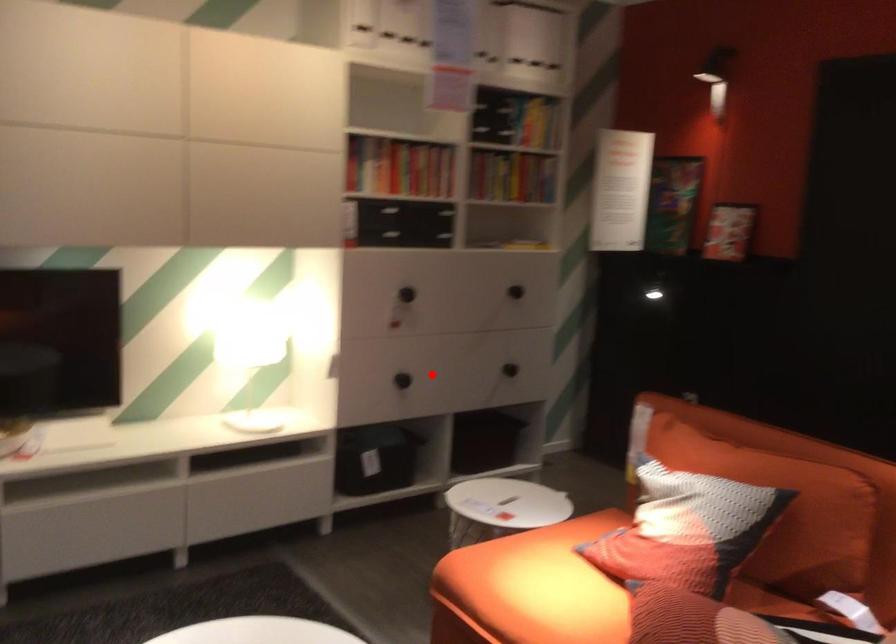
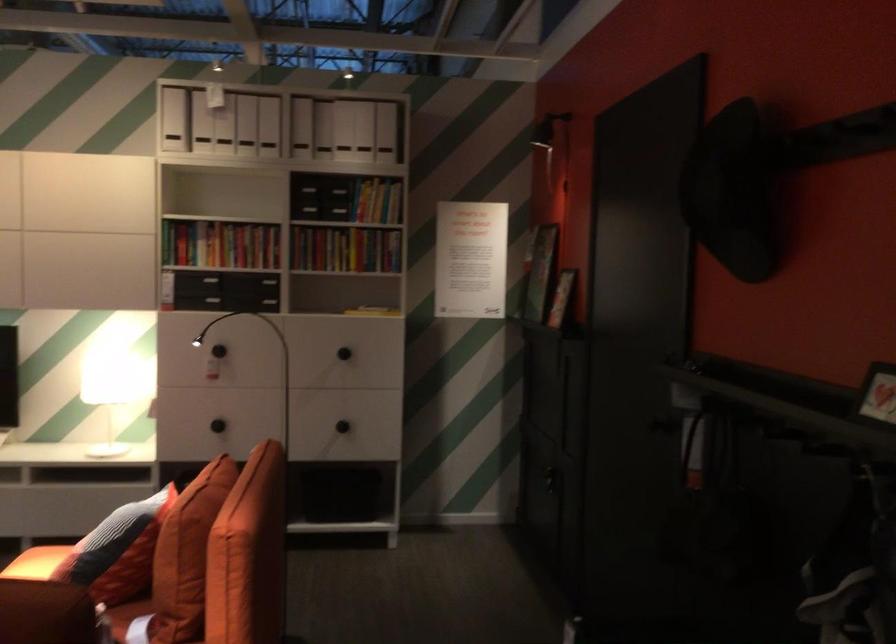
The point at the highlighted location is marked in the first image. Where is the corresponding point in the second image?

(218, 426)